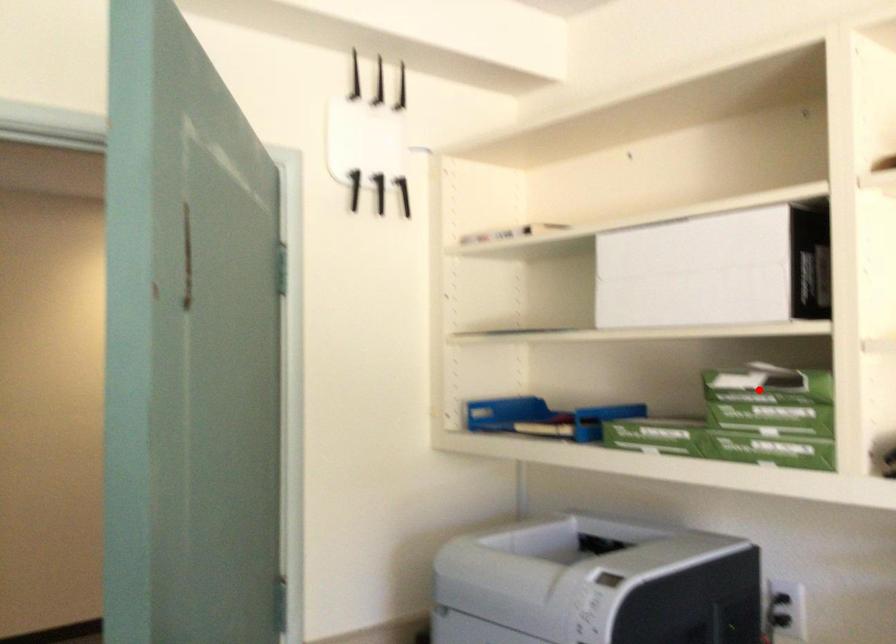
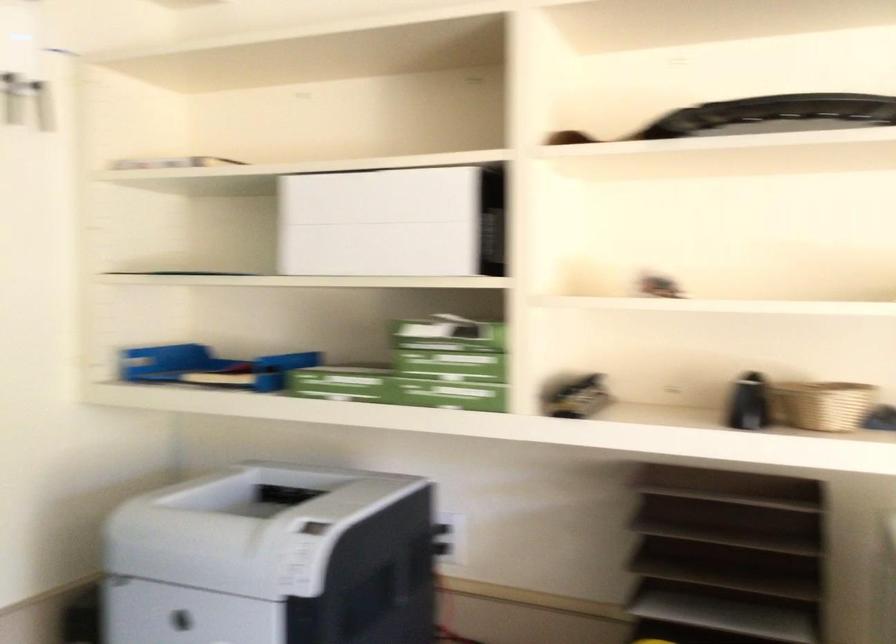
Find the pixel in the second image that matches the highlighted location in the first image.

(446, 335)